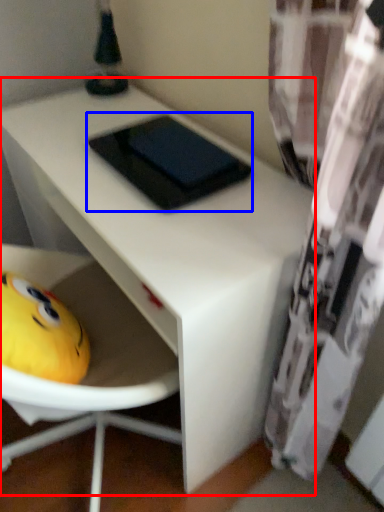
Question: Which object appears closest to the camera in this image, table (highlighted by a red box) or pad (highlighted by a blue box)?

Choices:
 (A) table
 (B) pad

Answer: (A)